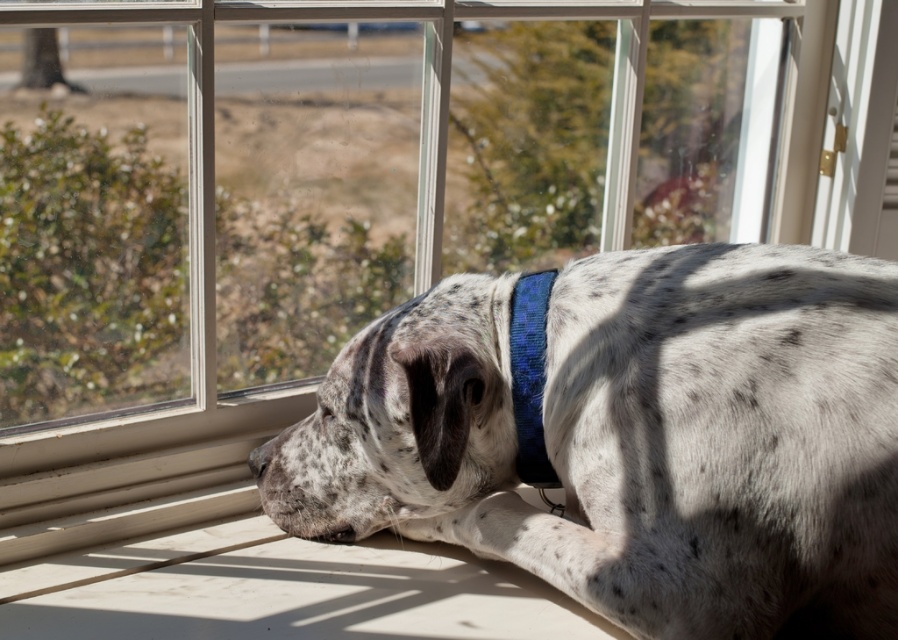
Question: Is speckled fur at lower center wider than blue textured fabric neckband at center?

Choices:
 (A) yes
 (B) no

Answer: (A)

Question: Which of the following is the farthest from the observer?

Choices:
 (A) (355, 378)
 (B) (541, 356)

Answer: (A)

Question: Can you confirm if speckled fur at lower center is thinner than blue textured fabric neckband at center?

Choices:
 (A) no
 (B) yes

Answer: (A)

Question: Is speckled fur at lower center to the left of blue textured fabric neckband at center from the viewer's perspective?

Choices:
 (A) no
 (B) yes

Answer: (A)